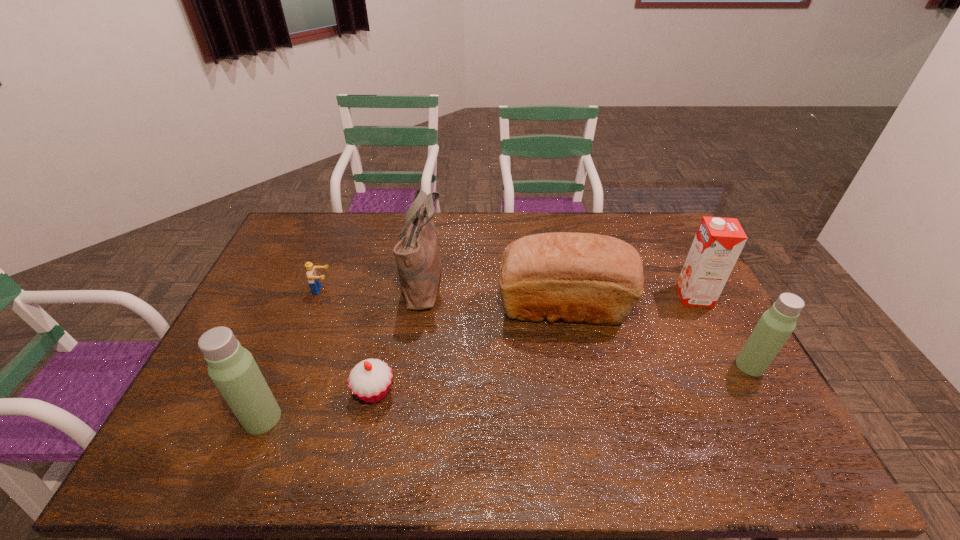
Locate an element on the screen. The image size is (960, 540). vacant region that satisfies the following two spatial constraints: 1. on the front-facing side of the shoulder bag; 2. on the front side of the left thermos bottle is located at coordinates point(405,418).

Find the location of a particular element. The height and width of the screenshot is (540, 960). blank space that satisfies the following two spatial constraints: 1. on the front-facing side of the shoulder bag; 2. on the right side of the carton is located at coordinates (422, 296).

Locate an element on the screen. The width and height of the screenshot is (960, 540). vacant space that satisfies the following two spatial constraints: 1. on the back side of the nearer thermos bottle; 2. on the left side of the bread is located at coordinates (306, 308).